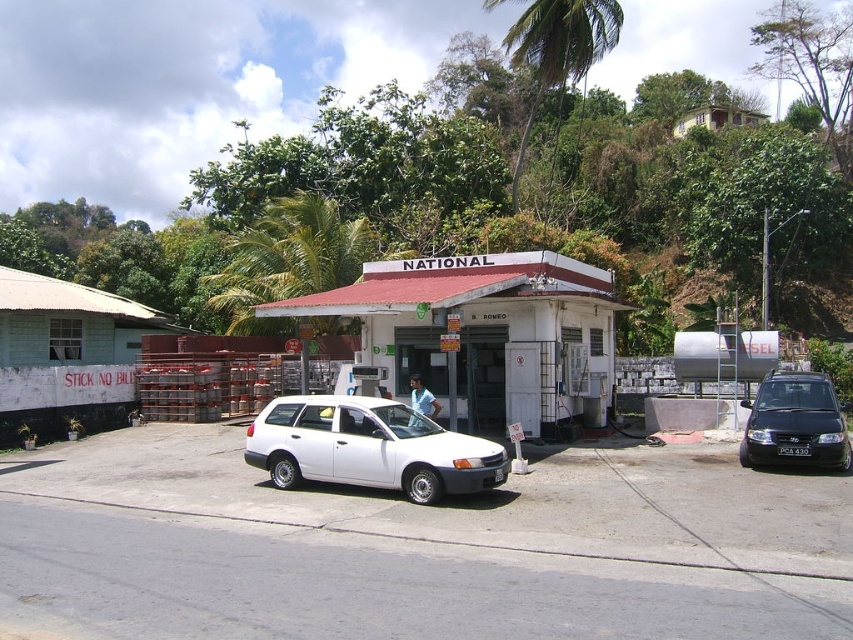
Question: Which of the following is the closest to the observer?

Choices:
 (A) (804, 433)
 (B) (381, 458)

Answer: (B)

Question: Which of the following is the closest to the observer?

Choices:
 (A) black matte van at right
 (B) white matte wagon at center

Answer: (B)

Question: Where is white matte wagon at center located in relation to black matte van at right in the image?

Choices:
 (A) right
 (B) left

Answer: (B)

Question: Is the position of white matte wagon at center more distant than that of black matte van at right?

Choices:
 (A) yes
 (B) no

Answer: (B)

Question: Is white matte wagon at center in front of black matte van at right?

Choices:
 (A) yes
 (B) no

Answer: (A)